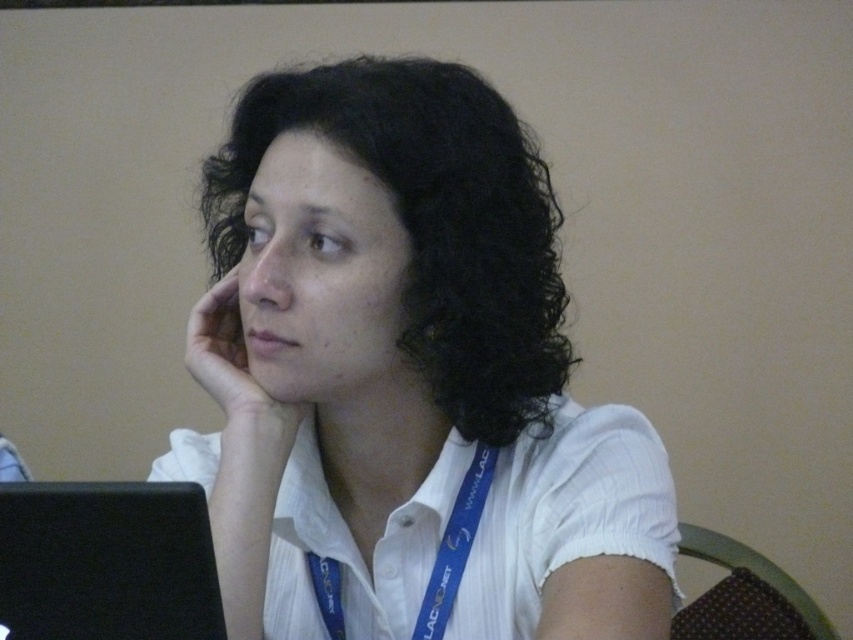
Question: Which of the following is the farthest from the observer?

Choices:
 (A) (218, 307)
 (B) (173, 513)
 (C) (485, 548)

Answer: (A)

Question: In this image, where is blue fabric lanyard at center located relative to black matte laptop at lower left?

Choices:
 (A) below
 (B) above

Answer: (A)

Question: Where is black matte laptop at lower left located in relation to skinsmoothhand at left in the image?

Choices:
 (A) left
 (B) right

Answer: (A)

Question: Among these points, which one is farthest from the camera?

Choices:
 (A) (294, 502)
 (B) (216, 349)
 (C) (128, 524)

Answer: (B)

Question: Is white matte shirt at center thinner than skinsmoothhand at left?

Choices:
 (A) yes
 (B) no

Answer: (B)

Question: Which of the following is the farthest from the observer?

Choices:
 (A) blue fabric lanyard at center
 (B) black matte laptop at lower left

Answer: (A)